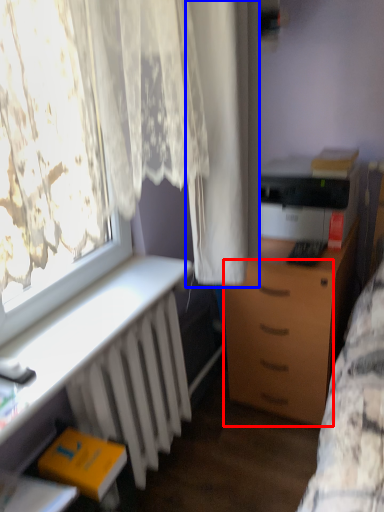
Question: Which object appears farthest to the camera in this image, drawer (highlighted by a red box) or curtain (highlighted by a blue box)?

Choices:
 (A) drawer
 (B) curtain

Answer: (A)